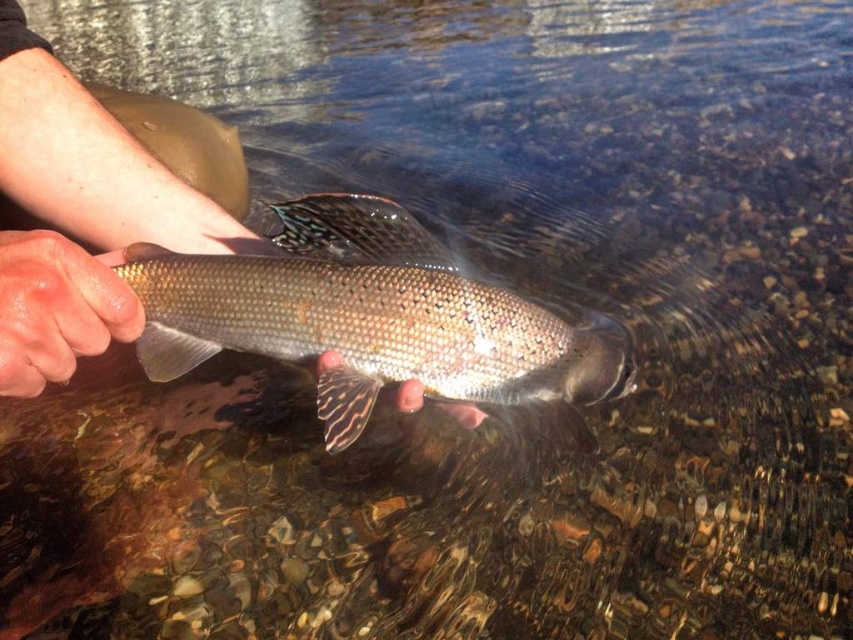
Question: Which point appears closest to the camera in this image?

Choices:
 (A) [196, 193]
 (B) [78, 250]
 (C) [299, 305]

Answer: (B)

Question: Is smooth skin hand at center behind dry skin at center?

Choices:
 (A) no
 (B) yes

Answer: (A)

Question: Can you confirm if shiny silver fish at center is positioned to the left of dry skin at center?

Choices:
 (A) yes
 (B) no

Answer: (B)

Question: Considering the real-world distances, which object is closest to the shiny silver fish at center?

Choices:
 (A) dry skin at center
 (B) smooth skin hand at center

Answer: (B)

Question: Which point is closer to the camera?

Choices:
 (A) smooth skin hand at center
 (B) shiny silver fish at center

Answer: (A)

Question: Can you confirm if smooth skin hand at center is bigger than dry skin at center?

Choices:
 (A) yes
 (B) no

Answer: (A)